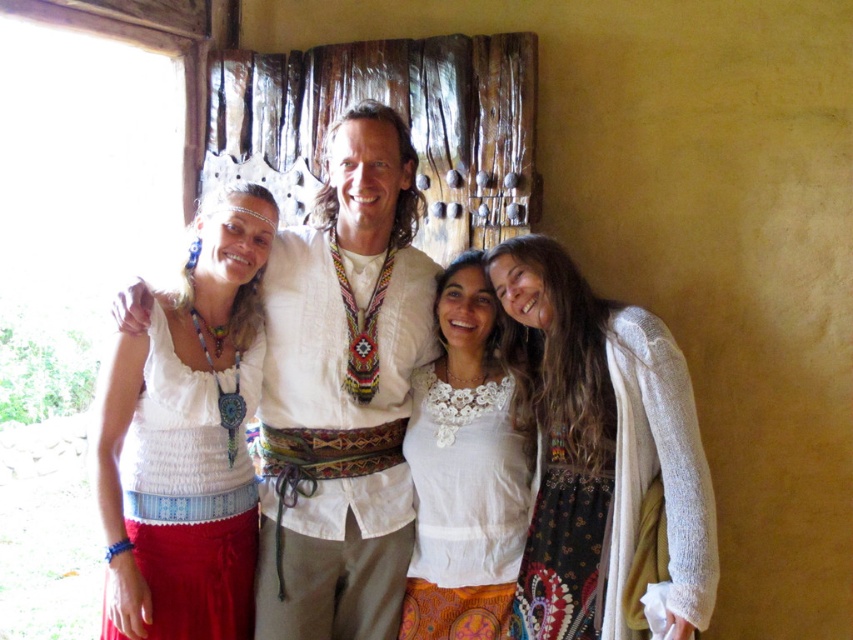
Looking at this image, can you confirm if white textured sweater at right is smaller than white lace blouse at center?

Actually, white textured sweater at right might be larger than white lace blouse at center.

Does point (669, 636) lie in front of point (506, 458)?

Yes, point (669, 636) is closer to viewer.

This screenshot has height=640, width=853. I want to click on white textured sweater at right, so click(x=605, y=458).

Does white textured sweater at right lie behind white cotton top at center?

No, it is in front of white cotton top at center.

Between point (611, 484) and point (186, 515), which one is positioned behind?

The point (186, 515) is behind.

The image size is (853, 640). In order to click on white textured sweater at right in this screenshot , I will do `click(605, 458)`.

Can you confirm if white woven shirt at center is positioned to the right of white lace blouse at center?

Incorrect, white woven shirt at center is not on the right side of white lace blouse at center.

Between white woven shirt at center and white lace blouse at center, which one appears on the left side from the viewer's perspective?

Positioned to the left is white woven shirt at center.

Find the location of a particular element. white woven shirt at center is located at coordinates (343, 390).

Identify the location of white woven shirt at center. Image resolution: width=853 pixels, height=640 pixels. (343, 390).